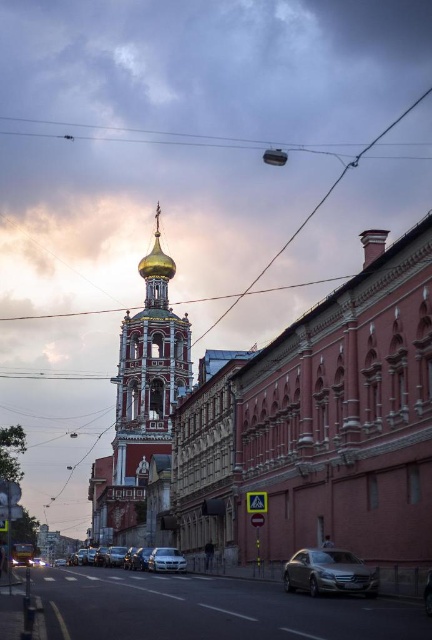
Question: Is metallic wire at upper center in front of silver metallic car at center?

Choices:
 (A) yes
 (B) no

Answer: (B)

Question: Is gold domed church at upper left thinner than metallic wire at upper center?

Choices:
 (A) no
 (B) yes

Answer: (B)

Question: Based on their relative distances, which object is farther from the metallic wire at upper center?

Choices:
 (A) satin silver sedan at lower right
 (B) silver metallic car at center
 (C) gold domed bell tower at center
 (D) gold domed church at upper left

Answer: (A)

Question: Which point is closer to the camera?

Choices:
 (A) (419, 440)
 (B) (132, 554)
 (C) (162, 131)
 (D) (118, 476)

Answer: (A)

Question: Does gold domed bell tower at center lie behind silver metallic car at center?

Choices:
 (A) yes
 (B) no

Answer: (A)

Question: Which point is closer to the camera taking this photo?

Choices:
 (A) (362, 588)
 (B) (181, 349)

Answer: (A)